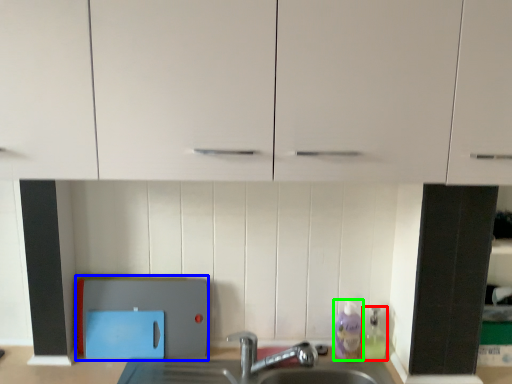
Question: Based on their relative distances, which object is nearer to cleaning product (highlighted by a red box)? Choose from appliance (highlighted by a blue box) and cleaning product (highlighted by a green box).

Choices:
 (A) appliance
 (B) cleaning product

Answer: (B)